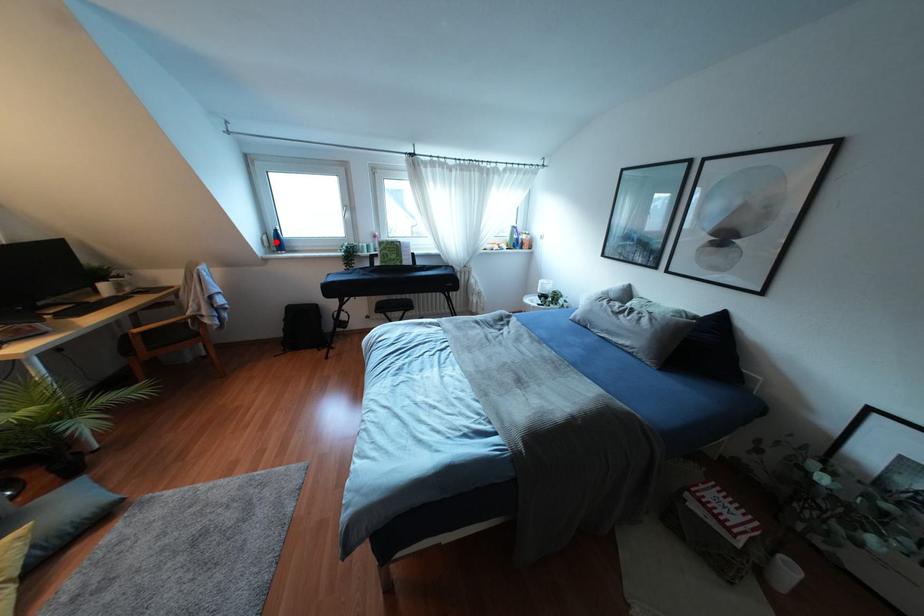
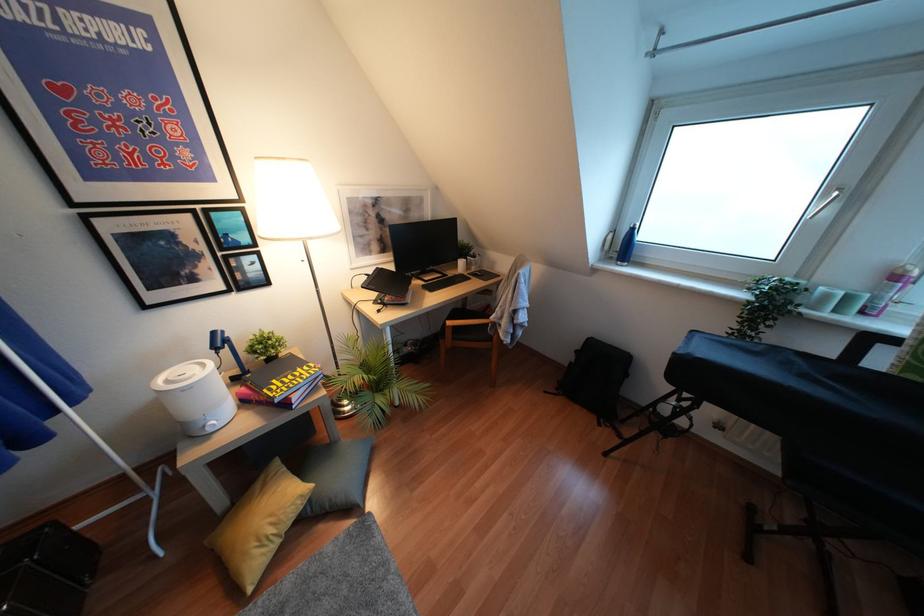
Question: I am providing you with two images of the same scene from different viewpoints. A red point is marked on the first image. Can you still see the location of the red point in image 2?

Choices:
 (A) Yes
 (B) No

Answer: (A)